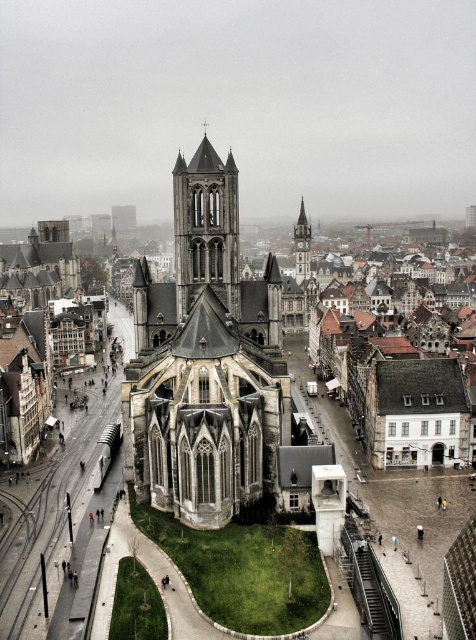
Question: Among these objects, which one is nearest to the camera?

Choices:
 (A) smooth stone clock tower at center right
 (B) smooth stone tower at center

Answer: (B)

Question: Does smooth stone tower at center have a lesser width compared to smooth stone clock tower at center right?

Choices:
 (A) no
 (B) yes

Answer: (A)

Question: From the image, what is the correct spatial relationship of smooth stone tower at center in relation to smooth stone clock tower at center right?

Choices:
 (A) above
 (B) below

Answer: (B)

Question: Does smooth stone tower at center appear on the right side of smooth stone clock tower at center right?

Choices:
 (A) no
 (B) yes

Answer: (A)

Question: Which point appears farthest from the camera in this image?

Choices:
 (A) (297, 234)
 (B) (204, 269)

Answer: (A)